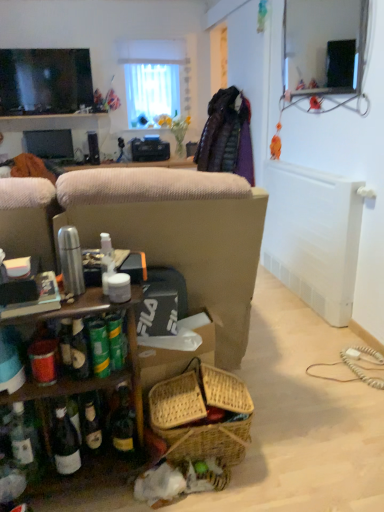
Measure the distance between matte black tv at upper left, the first television viewed from the top, and camera.

They are 4.23 meters apart.

What do you see at coordinates (44, 81) in the screenshot? I see `matte black tv at upper left, placed as the second television when sorted from bottom to top` at bounding box center [44, 81].

What are the coordinates of `matte black monitor at left, the 2th television from the front` in the screenshot? It's located at point(49,143).

How much space does matte black monitor at left, acting as the 2th television starting from the top, occupy horizontally?

The width of matte black monitor at left, acting as the 2th television starting from the top, is 4.62 centimeters.

What are the coordinates of `matte black tv at upper left, the first television viewed from the top` in the screenshot? It's located at (44, 81).

Is white sheer curtain at upper center at the right side of matte black tv at upper left, the 1th television positioned from the front?

Indeed, white sheer curtain at upper center is positioned on the right side of matte black tv at upper left, the 1th television positioned from the front.

From a real-world perspective, is white sheer curtain at upper center over matte black tv at upper left, the second television viewed from the back?

Yes.

Choose the correct answer: Is white sheer curtain at upper center inside matte black tv at upper left, placed as the second television when sorted from bottom to top, or outside it?

white sheer curtain at upper center exists outside the volume of matte black tv at upper left, placed as the second television when sorted from bottom to top.

From the image's perspective, does matte black monitor at left, acting as the 2th television starting from the top, appear lower than matte black tv at upper left, placed as the second television when sorted from bottom to top?

Yes, from the image's perspective, matte black monitor at left, acting as the 2th television starting from the top, is beneath matte black tv at upper left, placed as the second television when sorted from bottom to top.

Are matte black monitor at left, the 2th television from the front, and matte black tv at upper left, placed as the second television when sorted from bottom to top, making contact?

matte black monitor at left, the 2th television from the front, and matte black tv at upper left, placed as the second television when sorted from bottom to top, are not in contact.

Is matte black monitor at left, the 2th television from the front, not inside matte black tv at upper left, placed as the second television when sorted from bottom to top?

That's correct, matte black monitor at left, the 2th television from the front, is outside of matte black tv at upper left, placed as the second television when sorted from bottom to top.

The image size is (384, 512). Find the location of `television that appears above the matte black monitor at left, the 2th television from the front (from the image's perspective)`. television that appears above the matte black monitor at left, the 2th television from the front (from the image's perspective) is located at coordinates (44, 81).

How many degrees apart are the facing directions of matte black monitor at left, which appears as the first television when viewed from the back, and white sheer curtain at upper center?

The angular difference between matte black monitor at left, which appears as the first television when viewed from the back, and white sheer curtain at upper center is 2.28 degrees.

Considering the relative positions of matte black monitor at left, acting as the 2th television starting from the top, and white sheer curtain at upper center in the image provided, is matte black monitor at left, acting as the 2th television starting from the top, to the left of white sheer curtain at upper center from the viewer's perspective?

Indeed, matte black monitor at left, acting as the 2th television starting from the top, is positioned on the left side of white sheer curtain at upper center.

In the scene shown: Which is in front, matte black monitor at left, acting as the 2th television starting from the top, or white sheer curtain at upper center?

matte black monitor at left, acting as the 2th television starting from the top, is in front.

Considering the relative sizes of matte black monitor at left, which appears as the first television when ordered from the bottom, and white sheer curtain at upper center in the image provided, is matte black monitor at left, which appears as the first television when ordered from the bottom, thinner than white sheer curtain at upper center?

Yes, matte black monitor at left, which appears as the first television when ordered from the bottom, is thinner than white sheer curtain at upper center.

Which object is positioned more to the left, matte black tv at upper left, placed as the second television when sorted from bottom to top, or matte black monitor at left, the 2th television from the front?

matte black monitor at left, the 2th television from the front, is more to the left.

Between matte black tv at upper left, the second television viewed from the back, and matte black monitor at left, acting as the 2th television starting from the top, which one is positioned behind?

matte black monitor at left, acting as the 2th television starting from the top, is further from the camera.

Measure the distance from matte black tv at upper left, the 1th television positioned from the front, to matte black monitor at left, which appears as the first television when viewed from the back.

The distance of matte black tv at upper left, the 1th television positioned from the front, from matte black monitor at left, which appears as the first television when viewed from the back, is 46.13 centimeters.

Is matte black tv at upper left, the second television viewed from the back, with matte black monitor at left, the 2th television from the front?

No, matte black tv at upper left, the second television viewed from the back, is not next to matte black monitor at left, the 2th television from the front.

From a real-world perspective, is white sheer curtain at upper center physically below matte black monitor at left, the 2th television from the front?

Actually, white sheer curtain at upper center is physically above matte black monitor at left, the 2th television from the front, in the real world.

Does point (155, 72) appear closer or farther from the camera than point (45, 141)?

Point (155, 72).

Looking at this image, considering the sizes of white sheer curtain at upper center and matte black monitor at left, the 2th television from the front, in the image, is white sheer curtain at upper center wider or thinner than matte black monitor at left, the 2th television from the front,?

Considering their sizes, white sheer curtain at upper center looks broader than matte black monitor at left, the 2th television from the front.

Considering the positions of objects matte black tv at upper left, the first television viewed from the top, and white sheer curtain at upper center in the image provided, who is more to the left, matte black tv at upper left, the first television viewed from the top, or white sheer curtain at upper center?

matte black tv at upper left, the first television viewed from the top, is more to the left.

From the image's perspective, who appears lower, matte black tv at upper left, the second television viewed from the back, or white sheer curtain at upper center?

matte black tv at upper left, the second television viewed from the back, from the image's perspective.

There is a white sheer curtain at upper center. Identify the location of the 1st television below it (from the image's perspective). (44, 81).

Image resolution: width=384 pixels, height=512 pixels. I want to click on television on the right of matte black monitor at left, which appears as the first television when viewed from the back, so click(x=44, y=81).

Looking at the image, which one is located closer to white sheer curtain at upper center, matte black monitor at left, acting as the 2th television starting from the top, or matte black tv at upper left, the second television viewed from the back?

matte black tv at upper left, the second television viewed from the back.

Looking at this image, when comparing their distances from matte black tv at upper left, the first television viewed from the top, does white sheer curtain at upper center or matte black monitor at left, acting as the 2th television starting from the top, seem further?

Among the two, white sheer curtain at upper center is located further to matte black tv at upper left, the first television viewed from the top.

Which object lies nearer to the anchor point white sheer curtain at upper center, matte black tv at upper left, the second television viewed from the back, or matte black monitor at left, which appears as the first television when viewed from the back?

Among the two, matte black tv at upper left, the second television viewed from the back, is located nearer to white sheer curtain at upper center.

Estimate the real-world distances between objects in this image. Which object is closer to matte black tv at upper left, the 1th television positioned from the front, matte black monitor at left, acting as the 2th television starting from the top, or white sheer curtain at upper center?

matte black monitor at left, acting as the 2th television starting from the top, is closer to matte black tv at upper left, the 1th television positioned from the front.

From the image, which object appears to be nearer to matte black monitor at left, which appears as the first television when viewed from the back, white sheer curtain at upper center or matte black tv at upper left, the 1th television positioned from the front?

matte black tv at upper left, the 1th television positioned from the front, is positioned closer to the anchor matte black monitor at left, which appears as the first television when viewed from the back.

Estimate the real-world distances between objects in this image. Which object is closer to matte black monitor at left, acting as the 2th television starting from the top, matte black tv at upper left, the 1th television positioned from the front, or white sheer curtain at upper center?

matte black tv at upper left, the 1th television positioned from the front, lies closer to matte black monitor at left, acting as the 2th television starting from the top, than the other object.

Identify the location of television situated between matte black monitor at left, the 2th television from the front, and white sheer curtain at upper center from left to right. pos(44,81).